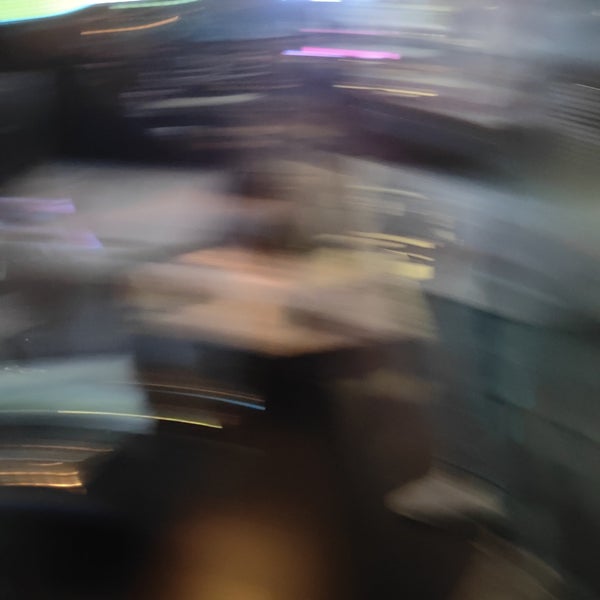
Identify the location of blurry slats. The height and width of the screenshot is (600, 600). (572, 100).